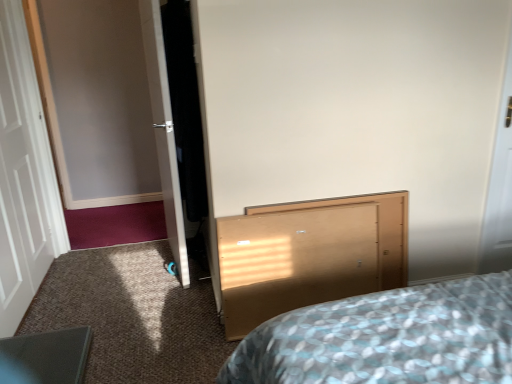
Where is `white wooden door at left, which ranks as the second door in right-to-left order`? Image resolution: width=512 pixels, height=384 pixels. white wooden door at left, which ranks as the second door in right-to-left order is located at coordinates (24, 176).

In order to face light wood vanity at center, should I rotate leftwards or rightwards?

Rotate your view right by about 6.319°.

Find the location of `white wooden door at left, which ranks as the second door in right-to-left order`. white wooden door at left, which ranks as the second door in right-to-left order is located at coordinates (24, 176).

Looking at this image, which object is closer to the camera, white glossy door at left, which appears as the 2th door when viewed from the left, or light wood vanity at center?

light wood vanity at center is more forward.

Is white glossy door at left, the first door from the right, completely or partially outside of light wood vanity at center?

Indeed, white glossy door at left, the first door from the right, is completely outside light wood vanity at center.

Consider the image. Which is nearer, [147,51] or [355,261]?

Positioned in front is point [355,261].

How different are the orientations of white wooden door at left, which ranks as the second door in right-to-left order, and light wood vanity at center in degrees?

They differ by 89.9 degrees in their facing directions.

How distant is white wooden door at left, which ranks as the second door in right-to-left order, from light wood vanity at center?

The distance of white wooden door at left, which ranks as the second door in right-to-left order, from light wood vanity at center is 6.07 feet.

Considering their positions, is white wooden door at left, which ranks as the second door in right-to-left order, located in front of or behind light wood vanity at center?

Visually, white wooden door at left, which ranks as the second door in right-to-left order, is located in front of light wood vanity at center.

Are white wooden door at left, arranged as the 1th door when viewed from the left, and light wood vanity at center far apart?

Yes, white wooden door at left, arranged as the 1th door when viewed from the left, and light wood vanity at center are quite far apart.

From a real-world perspective, relative to white wooden door at left, arranged as the 1th door when viewed from the left, is light wood vanity at center vertically above or below?

From a real-world perspective, light wood vanity at center is physically below white wooden door at left, arranged as the 1th door when viewed from the left.

Who is taller, light wood vanity at center or white wooden door at left, arranged as the 1th door when viewed from the left?

With more height is white wooden door at left, arranged as the 1th door when viewed from the left.

Is light wood vanity at center closer to the viewer compared to white wooden door at left, arranged as the 1th door when viewed from the left?

No, it is behind white wooden door at left, arranged as the 1th door when viewed from the left.

Looking at the image, does light wood vanity at center seem bigger or smaller compared to white wooden door at left, which ranks as the second door in right-to-left order?

Considering their sizes, light wood vanity at center takes up less space than white wooden door at left, which ranks as the second door in right-to-left order.

Which is nearer, (172,200) or (0,316)?

Positioned in front is point (172,200).

Is white glossy door at left, the first door from the right, turned away from white wooden door at left, arranged as the 1th door when viewed from the left?

Yes, white glossy door at left, the first door from the right,'s orientation is away from white wooden door at left, arranged as the 1th door when viewed from the left.

From a real-world perspective, relative to white wooden door at left, which ranks as the second door in right-to-left order, is white glossy door at left, the first door from the right, vertically above or below?

white glossy door at left, the first door from the right, is below white wooden door at left, which ranks as the second door in right-to-left order.

Considering the relative sizes of white wooden door at left, arranged as the 1th door when viewed from the left, and white glossy door at left, the first door from the right, in the image provided, is white wooden door at left, arranged as the 1th door when viewed from the left, taller than white glossy door at left, the first door from the right,?

Yes, white wooden door at left, arranged as the 1th door when viewed from the left, is taller than white glossy door at left, the first door from the right.

Is white wooden door at left, which ranks as the second door in right-to-left order, spatially inside white glossy door at left, the first door from the right, or outside of it?

white wooden door at left, which ranks as the second door in right-to-left order, is not inside white glossy door at left, the first door from the right, it's outside.

Can you see white wooden door at left, arranged as the 1th door when viewed from the left, touching white glossy door at left, the first door from the right?

white wooden door at left, arranged as the 1th door when viewed from the left, and white glossy door at left, the first door from the right, are not in contact.

From a real-world perspective, who is located higher, white wooden door at left, arranged as the 1th door when viewed from the left, or white glossy door at left, which appears as the 2th door when viewed from the left?

From a 3D spatial view, white wooden door at left, arranged as the 1th door when viewed from the left, is above.

Which of these two, light wood vanity at center or white glossy door at left, which appears as the 2th door when viewed from the left, stands shorter?

light wood vanity at center.

Consider the image. Does light wood vanity at center lie in front of white glossy door at left, the first door from the right?

Yes, light wood vanity at center is closer to the viewer.

Where is `door that is the 2nd one when counting upward from the light wood vanity at center (from the image's perspective)`? door that is the 2nd one when counting upward from the light wood vanity at center (from the image's perspective) is located at coordinates (164, 133).

Is light wood vanity at center not inside white glossy door at left, which appears as the 2th door when viewed from the left?

Yes, light wood vanity at center is not within white glossy door at left, which appears as the 2th door when viewed from the left.

Identify the location of vanity on the right of white glossy door at left, which appears as the 2th door when viewed from the left. pos(309,255).

In order to click on door located in front of the light wood vanity at center in this screenshot , I will do `click(24, 176)`.

Considering their positions, is white wooden door at left, which ranks as the second door in right-to-left order, positioned closer to light wood vanity at center than white glossy door at left, which appears as the 2th door when viewed from the left?

white glossy door at left, which appears as the 2th door when viewed from the left, is closer to light wood vanity at center.

When comparing their distances from white glossy door at left, which appears as the 2th door when viewed from the left, does white wooden door at left, which ranks as the second door in right-to-left order, or light wood vanity at center seem further?

white wooden door at left, which ranks as the second door in right-to-left order.

Looking at the image, which one is located closer to white glossy door at left, the first door from the right, light wood vanity at center or white wooden door at left, arranged as the 1th door when viewed from the left?

Among the two, light wood vanity at center is located nearer to white glossy door at left, the first door from the right.

Based on their spatial positions, is white glossy door at left, which appears as the 2th door when viewed from the left, or white wooden door at left, arranged as the 1th door when viewed from the left, closer to light wood vanity at center?

white glossy door at left, which appears as the 2th door when viewed from the left.

When comparing their distances from white wooden door at left, arranged as the 1th door when viewed from the left, does white glossy door at left, the first door from the right, or light wood vanity at center seem closer?

Among the two, white glossy door at left, the first door from the right, is located nearer to white wooden door at left, arranged as the 1th door when viewed from the left.

Considering their positions, is light wood vanity at center positioned closer to white wooden door at left, which ranks as the second door in right-to-left order, than white glossy door at left, which appears as the 2th door when viewed from the left?

Among the two, white glossy door at left, which appears as the 2th door when viewed from the left, is located nearer to white wooden door at left, which ranks as the second door in right-to-left order.

Where is `door between white wooden door at left, which ranks as the second door in right-to-left order, and light wood vanity at center`? door between white wooden door at left, which ranks as the second door in right-to-left order, and light wood vanity at center is located at coordinates (164, 133).